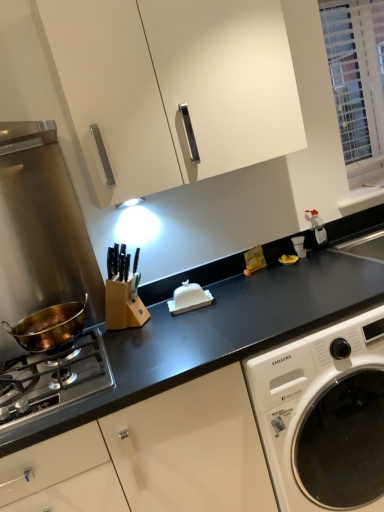
Question: Is point (365, 9) closer or farther from the camera than point (46, 336)?

Choices:
 (A) farther
 (B) closer

Answer: (A)

Question: From a real-world perspective, is white textured blinds at upper right positioned above or below bronze metallic wok at left?

Choices:
 (A) above
 (B) below

Answer: (A)

Question: Which object is the closest to the bronze metallic wok at left?

Choices:
 (A) bronze metallic pan at lower left
 (B) white matte cabinet at upper center
 (C) white glossy butter dish at center
 (D) white textured blinds at upper right
 (E) white glossy washing machine at lower right

Answer: (A)

Question: Which object is the farthest from the white matte cabinet at upper center?

Choices:
 (A) bronze metallic pan at lower left
 (B) bronze metallic wok at left
 (C) white textured blinds at upper right
 (D) white glossy butter dish at center
 (E) white glossy washing machine at lower right

Answer: (C)